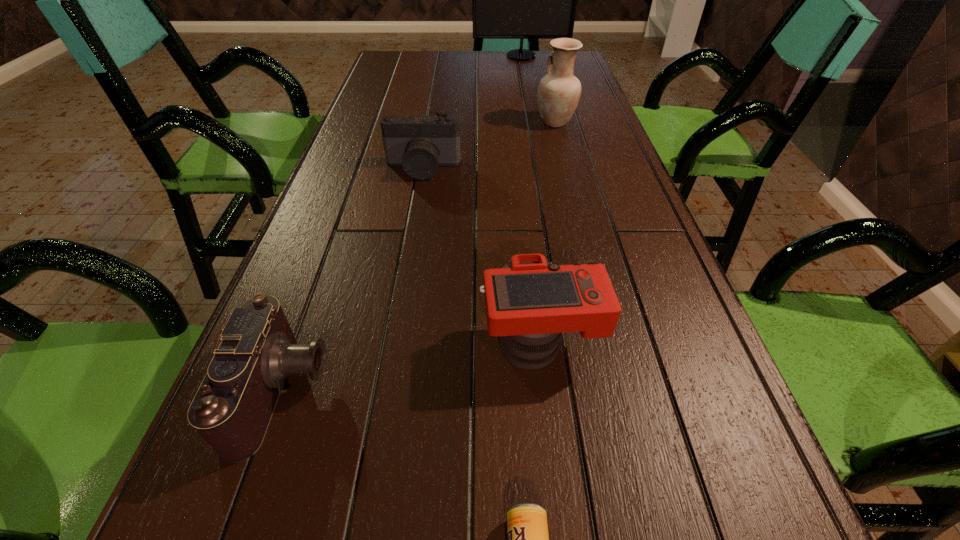
In order to click on object located at the far edge in this screenshot , I will do `click(521, 0)`.

Where is `computer monitor located at the right edge`? Image resolution: width=960 pixels, height=540 pixels. computer monitor located at the right edge is located at coordinates (521, 0).

The width and height of the screenshot is (960, 540). I want to click on pottery located in the right edge section of the desktop, so click(x=559, y=91).

You are a GUI agent. You are given a task and a screenshot of the screen. Output one action in this format:
    pyautogui.click(x=<x>, y=<y>)
    Task: Click on the object that is at the far right corner
    
    Given the screenshot: What is the action you would take?
    pyautogui.click(x=521, y=0)

You are a GUI agent. You are given a task and a screenshot of the screen. Output one action in this format:
    pyautogui.click(x=<x>, y=<y>)
    Task: Click on the vacant space at the far edge of the desktop
    This screenshot has height=540, width=960.
    Given the screenshot: What is the action you would take?
    pyautogui.click(x=431, y=67)

You are a GUI agent. You are given a task and a screenshot of the screen. Output one action in this format:
    pyautogui.click(x=<x>, y=<y>)
    Task: Click on the vacant space at the left edge
    The image size is (960, 540).
    Given the screenshot: What is the action you would take?
    pyautogui.click(x=341, y=163)

You are a GUI agent. You are given a task and a screenshot of the screen. Output one action in this format:
    pyautogui.click(x=<x>, y=<y>)
    Task: Click on the vacant region at the right edge of the desktop
    
    Given the screenshot: What is the action you would take?
    pyautogui.click(x=718, y=386)

Identify the location of blank space at the far left corner. This screenshot has width=960, height=540. (405, 65).

At what (x,y) coordinates should I click in order to perform the action: click on vacant space at the far right corner of the desktop. Please return your answer as a coordinate pair (x, y). Looking at the image, I should click on (540, 56).

Where is `unoccupied area between the rightmost camera and the computer monitor`? This screenshot has width=960, height=540. unoccupied area between the rightmost camera and the computer monitor is located at coordinates click(531, 199).